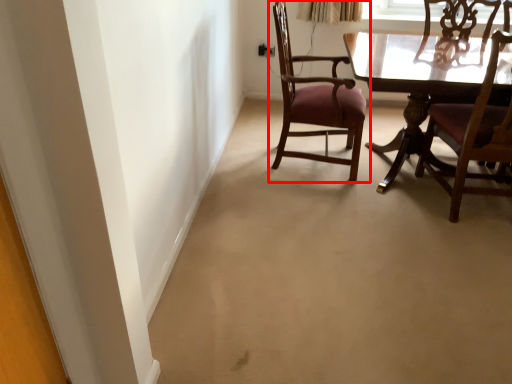
Question: In this image, where is chair (annotated by the red box) located relative to chair?

Choices:
 (A) right
 (B) left

Answer: (B)